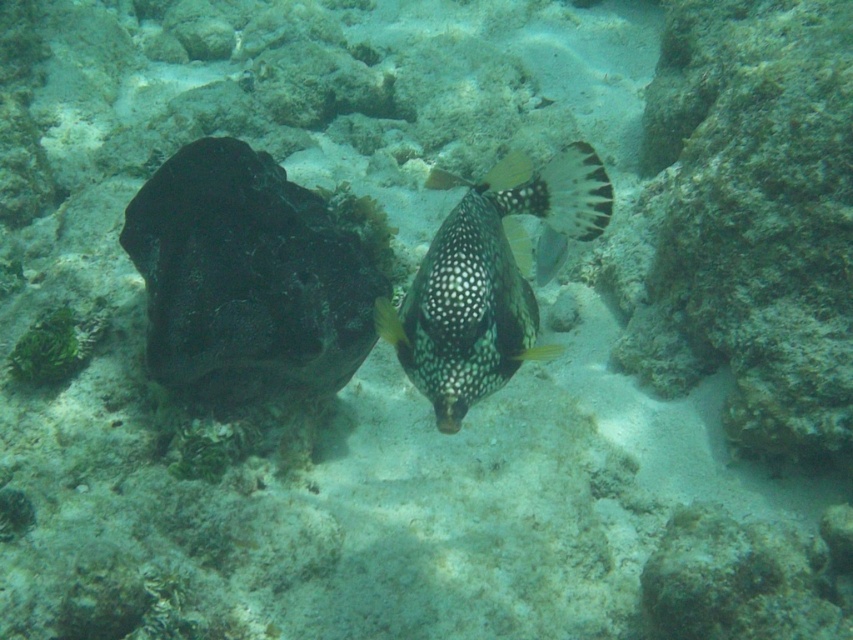
You are a marine biologist observing the underwater scene. You notice two fish at the center of the image. Which fish is closer to you, the speckled black fish at center or the speckled glossy fish at center?

The speckled black fish at center is closer to you because the speckled glossy fish at center is behind it.

You are a marine biologist observing an underwater scene. You notice the speckled black fish at center and the speckled glossy fish at center. Which fish do you think is bigger?

The speckled black fish at center is larger in size compared to the speckled glossy fish at center.